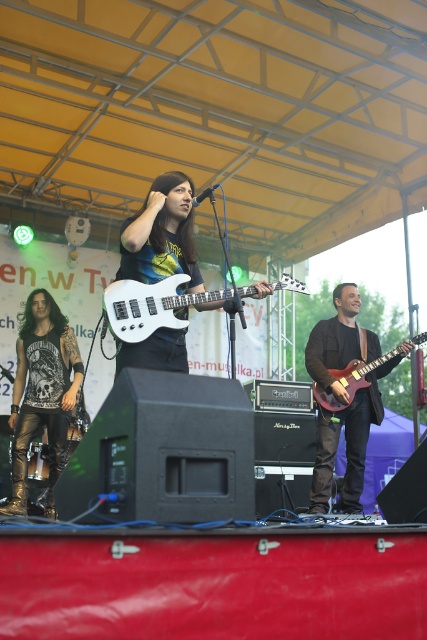
Is the position of shiny gold pants at center more distant than that of matte black guitar at center?

Yes.

Between shiny gold pants at center and matte black guitar at center, which one is positioned lower?

Positioned lower is shiny gold pants at center.

Who is more distant from viewer, (x=32, y=412) or (x=181, y=202)?

Positioned behind is point (x=32, y=412).

Locate an element on the screen. This screenshot has width=427, height=640. shiny gold pants at center is located at coordinates (41, 394).

Between point (163, 275) and point (332, 397), which one is positioned in front?

Point (163, 275) is in front.

Who is taller, matte black guitar at center or glossy wood guitar at right?

With more height is matte black guitar at center.

Does point (183, 252) lie behind point (357, 369)?

No, it is in front of (357, 369).

You are a GUI agent. You are given a task and a screenshot of the screen. Output one action in this format:
    pyautogui.click(x=<x>, y=<y>)
    Task: Click on the matte black guitar at center
    The height and width of the screenshot is (640, 427).
    Given the screenshot: What is the action you would take?
    pyautogui.click(x=161, y=234)

From the picture: Does white glossy electric guitar at center have a larger size compared to glossy wood guitar at right?

Correct, white glossy electric guitar at center is larger in size than glossy wood guitar at right.

Is point (143, 333) more distant than point (363, 369)?

No, (143, 333) is closer to viewer.

Between point (134, 314) and point (357, 371), which one is positioned behind?

Positioned behind is point (357, 371).

I want to click on white glossy electric guitar at center, so click(x=151, y=305).